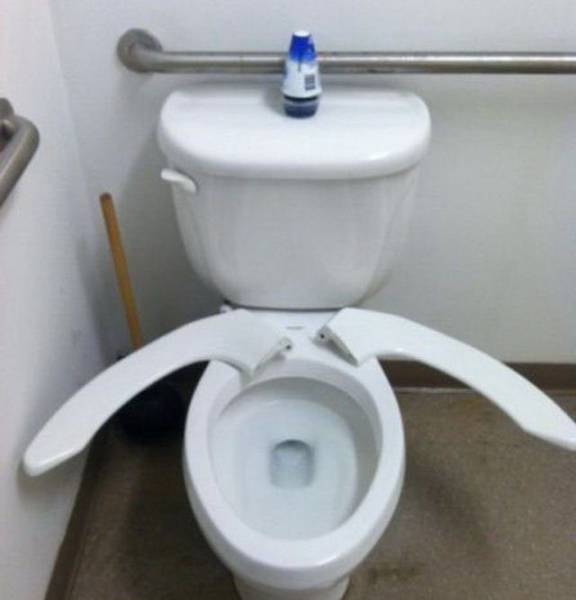
I want to click on toilet handle, so click(174, 176).